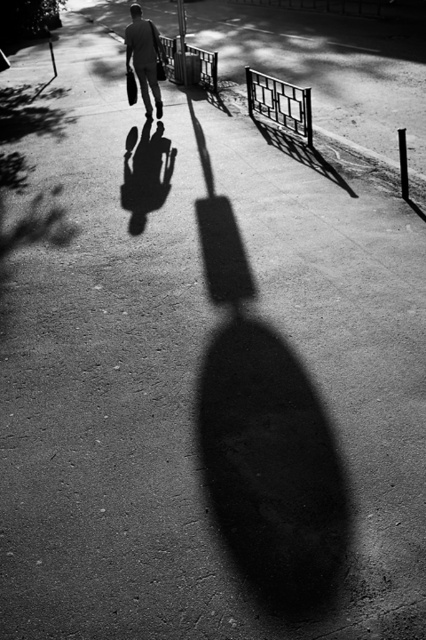
Is dark gray suit at center to the left of metallic gate at upper center from the viewer's perspective?

Correct, you'll find dark gray suit at center to the left of metallic gate at upper center.

Between point (137, 65) and point (187, 44), which one is positioned in front?

Point (137, 65) is in front.

Which is behind, point (140, 76) or point (216, 77)?

Point (216, 77)

Where is `dark gray suit at center`? The height and width of the screenshot is (640, 426). dark gray suit at center is located at coordinates (144, 58).

Is metallic grid fence at upper center to the right of metallic gate at upper center from the viewer's perspective?

Correct, you'll find metallic grid fence at upper center to the right of metallic gate at upper center.

Identify the location of metallic grid fence at upper center. The image size is (426, 640). (279, 104).

Identify the location of metallic grid fence at upper center. (279, 104).

Describe the element at coordinates (279, 104) in the screenshot. I see `metallic grid fence at upper center` at that location.

Is metallic grid fence at upper center below dark gray suit at center?

Yes, metallic grid fence at upper center is below dark gray suit at center.

This screenshot has width=426, height=640. What do you see at coordinates (279, 104) in the screenshot? I see `metallic grid fence at upper center` at bounding box center [279, 104].

Find the location of a particular element. Image resolution: width=426 pixels, height=640 pixels. metallic grid fence at upper center is located at coordinates (279, 104).